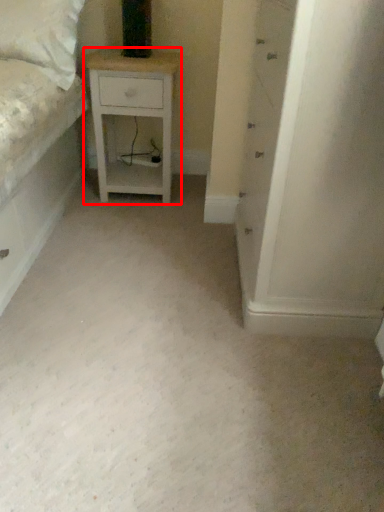
Question: From the image's perspective, what is the correct spatial relationship of nightstand (annotated by the red box) in relation to chest of drawers?

Choices:
 (A) below
 (B) above

Answer: (B)